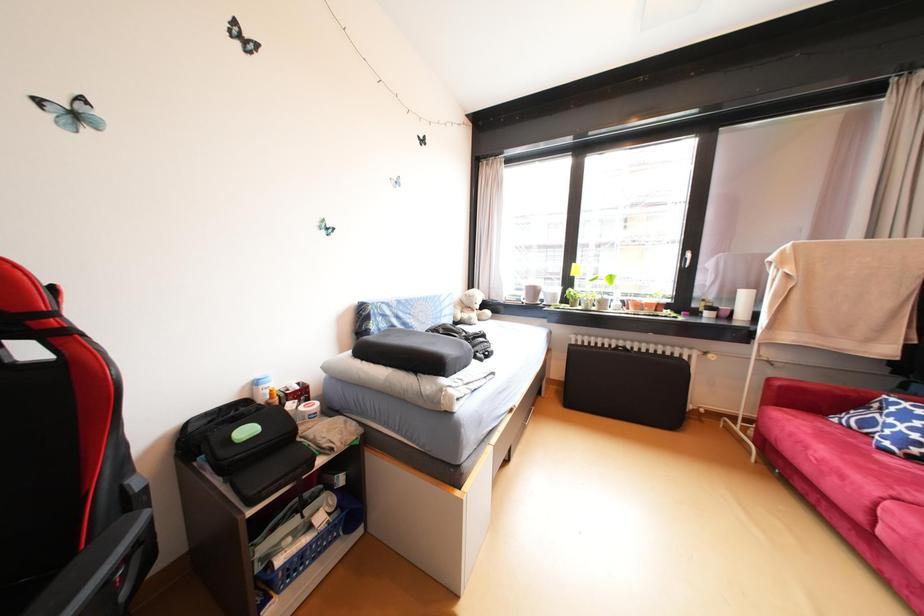
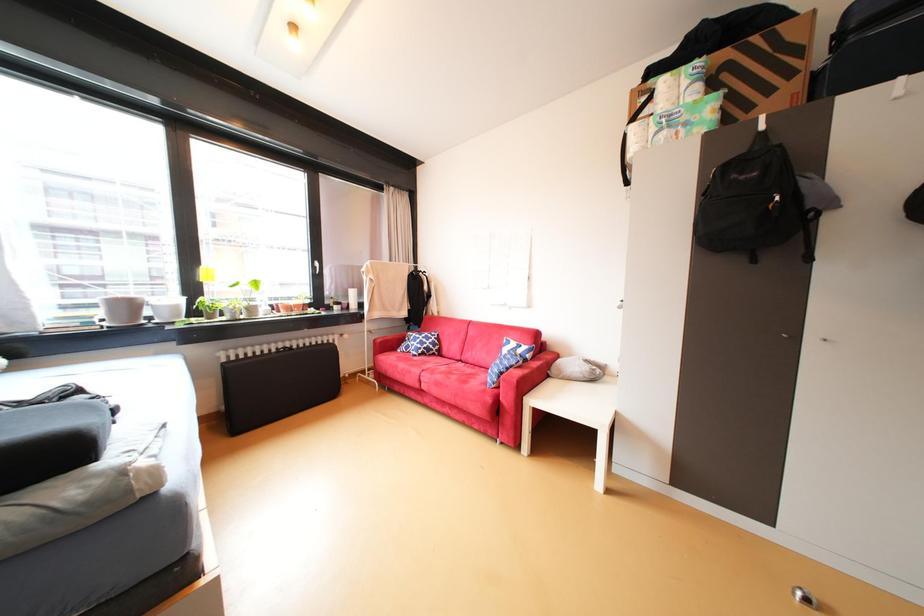
Question: The camera is either moving clockwise (left) or counter-clockwise (right) around the object. The first image is from the beginning of the video and the second image is from the end. Is the camera moving left or right when shooting the video?

Choices:
 (A) Left
 (B) Right

Answer: (A)